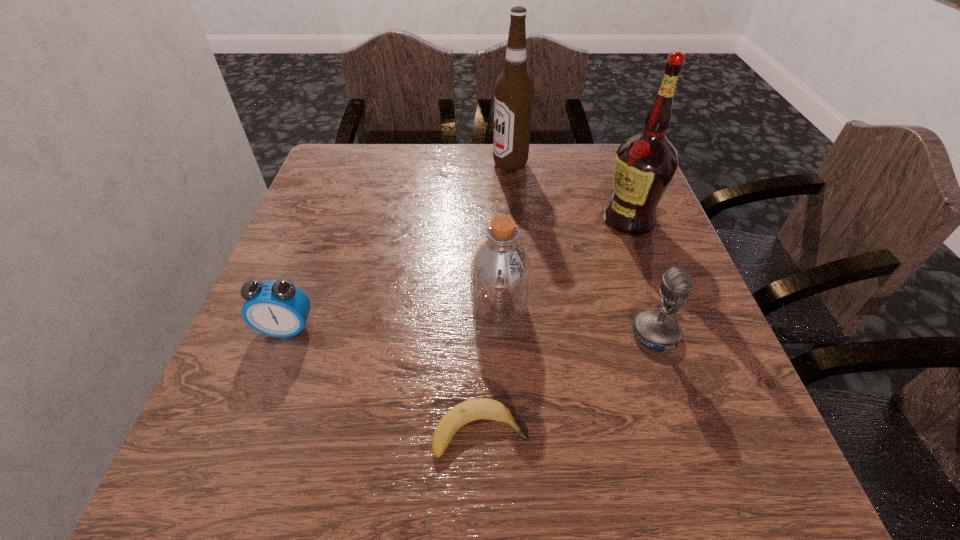
Where is `free space at the right edge of the desktop`? free space at the right edge of the desktop is located at coordinates (677, 347).

You are a GUI agent. You are given a task and a screenshot of the screen. Output one action in this format:
    pyautogui.click(x=<x>, y=<y>)
    Task: Click on the vacant space at the far left corner
    
    Given the screenshot: What is the action you would take?
    pyautogui.click(x=357, y=145)

Image resolution: width=960 pixels, height=540 pixels. Find the location of `empty space between the fourth tallest object and the nearest object`. empty space between the fourth tallest object and the nearest object is located at coordinates (567, 383).

Locate an element on the screen. The height and width of the screenshot is (540, 960). empty space between the fourth shortest object and the microphone is located at coordinates (577, 320).

The width and height of the screenshot is (960, 540). Find the location of `free space between the microphone and the farther alcohol`. free space between the microphone and the farther alcohol is located at coordinates (583, 249).

Identify the location of vacant area that lies between the right alcohol and the microphone. This screenshot has height=540, width=960. (641, 276).

The image size is (960, 540). I want to click on blank region between the bottle and the microphone, so click(x=577, y=320).

Locate an element on the screen. The image size is (960, 540). unoccupied position between the alarm clock and the left alcohol is located at coordinates (398, 246).

The image size is (960, 540). Identify the location of free space that is in between the banana and the bottle. (490, 369).

This screenshot has width=960, height=540. Find the location of `blank region between the third tallest object and the microphone`. blank region between the third tallest object and the microphone is located at coordinates (x=577, y=320).